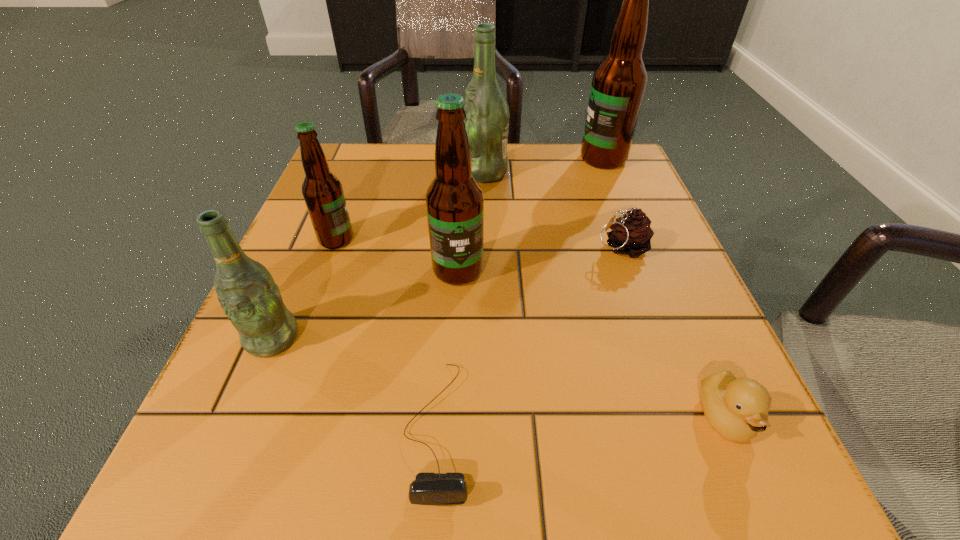
Identify which brown beer bottle is the closest to the smallest brown beer bottle. Please provide its 2D coordinates. Your answer should be formatted as a tuple, i.e. [(x, y)], where the tuple contains the x and y coordinates of a point satisfying the conditions above.

[(454, 200)]

The height and width of the screenshot is (540, 960). Identify the location of brown beer bottle that is the closest to the nearest brown beer bottle. (322, 191).

The width and height of the screenshot is (960, 540). Find the location of `vacant space that satisfies the following two spatial constraints: 1. on the label of the tallest beer bottle; 2. on the front-facing side of the webcam`. vacant space that satisfies the following two spatial constraints: 1. on the label of the tallest beer bottle; 2. on the front-facing side of the webcam is located at coordinates (710, 429).